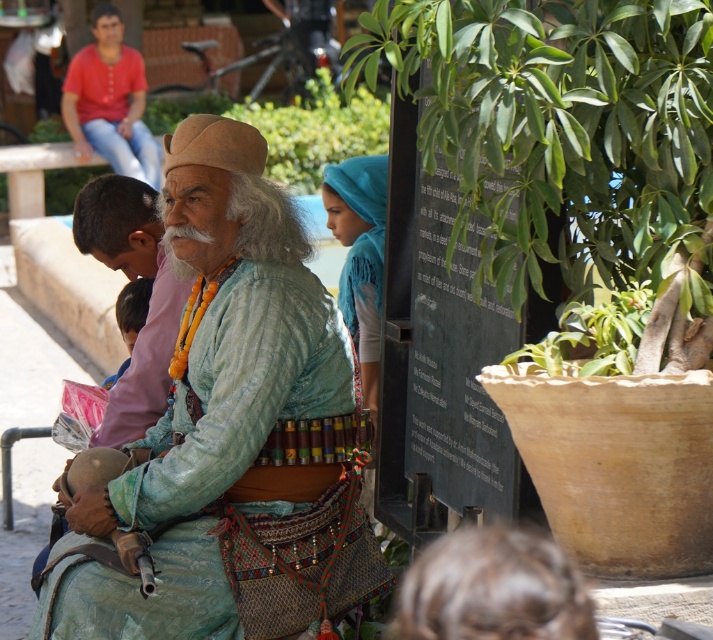
Where is the turquoise fabric at center located in the image?

The turquoise fabric at center is located at point (227,433) in the image.

You are standing in front of the man in traditional attire and want to place two markers at the coordinates point (314, 608) and point (73, 74). Which marker will be closer to you?

Point (314, 608) is closer to the viewer than point (73, 74).